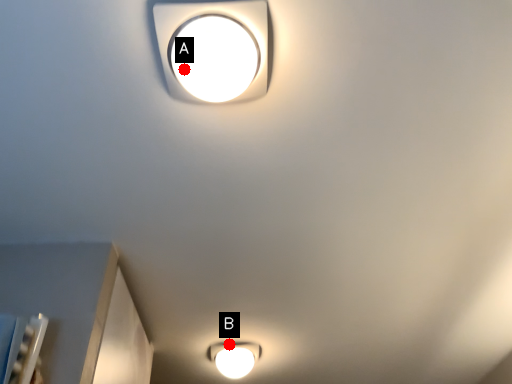
Question: Two points are circled on the image, labeled by A and B beside each circle. Which point is closer to the camera taking this photo?

Choices:
 (A) A is closer
 (B) B is closer

Answer: (A)